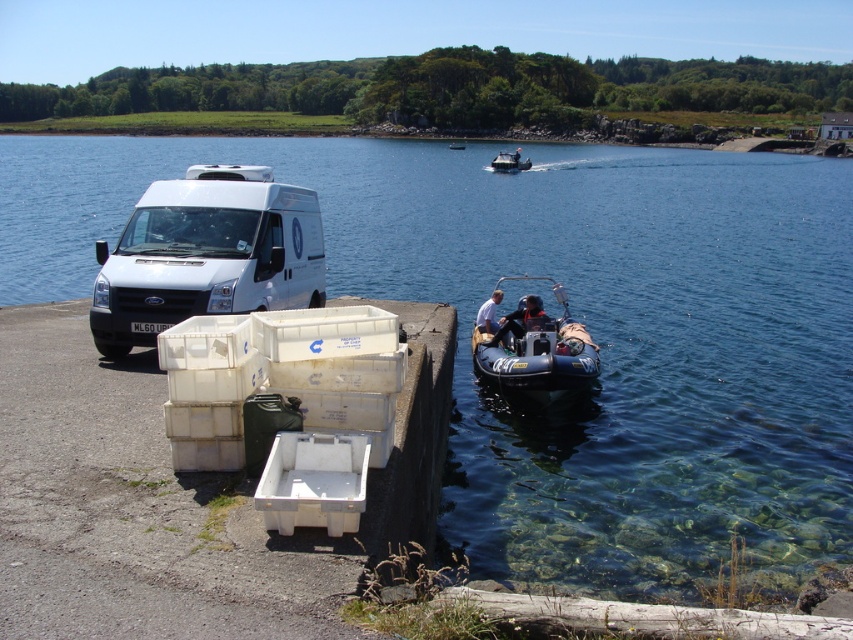
Question: Among these objects, which one is farthest from the camera?

Choices:
 (A) clear blue water at center
 (B) blue rubber boat at center
 (C) white matte van at left

Answer: (B)

Question: Which point appears closest to the camera in this image?

Choices:
 (A) (498, 172)
 (B) (561, 388)
 (C) (94, 228)

Answer: (B)

Question: Does white matte van at left have a larger size compared to white rubber dinghy at center?

Choices:
 (A) yes
 (B) no

Answer: (B)

Question: Is blue rubber boat at center above black rubber dinghy at center?

Choices:
 (A) no
 (B) yes

Answer: (A)

Question: In this image, where is white matte van at left located relative to blue rubber boat at center?

Choices:
 (A) above
 (B) below

Answer: (A)

Question: Which point appears farthest from the camera in this image?

Choices:
 (A) (201, 188)
 (B) (496, 340)

Answer: (B)